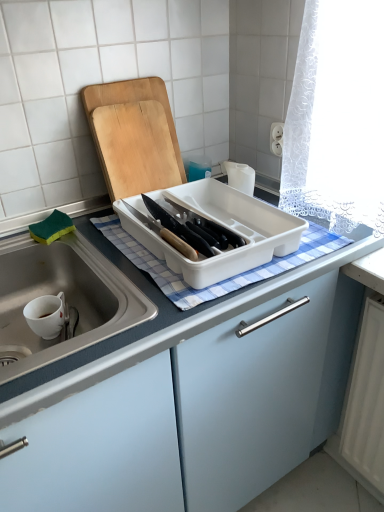
Question: Considering the relative sizes of white plastic tray at center and wooden cutting board at upper center in the image provided, is white plastic tray at center wider than wooden cutting board at upper center?

Choices:
 (A) yes
 (B) no

Answer: (A)

Question: From a real-world perspective, does white plastic tray at center stand above wooden cutting board at upper center?

Choices:
 (A) no
 (B) yes

Answer: (A)

Question: Is white plastic tray at center taller than wooden cutting board at upper center?

Choices:
 (A) no
 (B) yes

Answer: (A)

Question: Considering the relative positions of white plastic tray at center and wooden cutting board at upper center in the image provided, is white plastic tray at center to the right of wooden cutting board at upper center from the viewer's perspective?

Choices:
 (A) yes
 (B) no

Answer: (A)

Question: From the image's perspective, does white plastic tray at center appear lower than wooden cutting board at upper center?

Choices:
 (A) no
 (B) yes

Answer: (B)

Question: From a real-world perspective, is white plastic tray at center physically located above or below blue checkered cloth at center?

Choices:
 (A) above
 (B) below

Answer: (A)

Question: Choose the correct answer: Is white plastic tray at center inside blue checkered cloth at center or outside it?

Choices:
 (A) outside
 (B) inside

Answer: (A)

Question: Would you say white plastic tray at center is to the left or to the right of blue checkered cloth at center in the picture?

Choices:
 (A) right
 (B) left

Answer: (B)

Question: Is white plastic tray at center taller or shorter than blue checkered cloth at center?

Choices:
 (A) tall
 (B) short

Answer: (A)

Question: In the image, is wooden cutting board at upper center positioned in front of or behind blue checkered cloth at center?

Choices:
 (A) behind
 (B) front

Answer: (A)

Question: From a real-world perspective, relative to blue checkered cloth at center, is wooden cutting board at upper center vertically above or below?

Choices:
 (A) above
 (B) below

Answer: (A)

Question: From the image's perspective, relative to blue checkered cloth at center, is wooden cutting board at upper center above or below?

Choices:
 (A) above
 (B) below

Answer: (A)

Question: Looking at the image, does wooden cutting board at upper center seem bigger or smaller compared to blue checkered cloth at center?

Choices:
 (A) big
 (B) small

Answer: (A)

Question: From the image's perspective, is blue checkered cloth at center positioned above or below white plastic tray at center?

Choices:
 (A) below
 (B) above

Answer: (A)

Question: From a real-world perspective, is blue checkered cloth at center positioned above or below white plastic tray at center?

Choices:
 (A) below
 (B) above

Answer: (A)